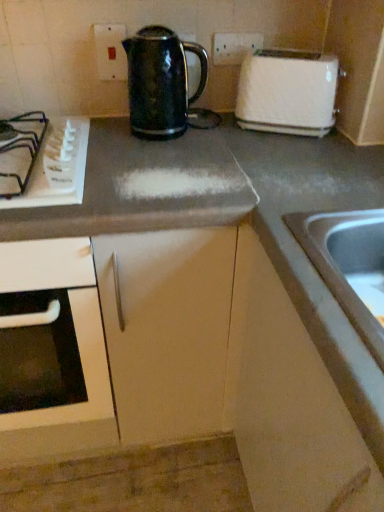
How much space does matte gray cabinet at lower right, positioned as the 1th cabinetry in right-to-left order, occupy horizontally?

matte gray cabinet at lower right, positioned as the 1th cabinetry in right-to-left order, is 61.93 centimeters in width.

What do you see at coordinates (299, 391) in the screenshot? I see `matte gray cabinet at lower right, positioned as the 1th cabinetry in right-to-left order` at bounding box center [299, 391].

What is the approximate height of white plastic gas stove at left?

It is 5.41 centimeters.

This screenshot has width=384, height=512. Find the location of `white plastic toaster at upper right`. white plastic toaster at upper right is located at coordinates (288, 92).

Measure the distance between white plastic toaster at upper right and camera.

3.39 feet.

This screenshot has width=384, height=512. Describe the element at coordinates (160, 81) in the screenshot. I see `shiny black kettle at center` at that location.

Image resolution: width=384 pixels, height=512 pixels. What do you see at coordinates (166, 328) in the screenshot?
I see `matte gray cabinet at center, placed as the 1th cabinetry when sorted from left to right` at bounding box center [166, 328].

At what (x,y) coordinates should I click in order to perform the action: click on matte gray cabinet at lower right, which is the 2th cabinetry in left-to-right order. Please return your answer as a coordinate pair (x, y). Looking at the image, I should click on (299, 391).

How distant is white plastic toaster at upper right from shiny black kettle at center?

They are 9.91 inches apart.

Which of these two, white plastic toaster at upper right or shiny black kettle at center, is wider?

shiny black kettle at center is wider.

Consider the image. How different are the orientations of white plastic toaster at upper right and shiny black kettle at center in degrees?

The angular difference between white plastic toaster at upper right and shiny black kettle at center is 27.7 degrees.

Considering the sizes of objects white plastic toaster at upper right and shiny black kettle at center in the image provided, who is taller, white plastic toaster at upper right or shiny black kettle at center?

shiny black kettle at center.

Considering the points (41, 190) and (242, 259), which point is behind, point (41, 190) or point (242, 259)?

The point (242, 259) is farther.

Can you confirm if white plastic gas stove at left is wider than matte gray cabinet at lower right, positioned as the 1th cabinetry in right-to-left order?

In fact, white plastic gas stove at left might be narrower than matte gray cabinet at lower right, positioned as the 1th cabinetry in right-to-left order.

From the image's perspective, is white plastic gas stove at left above or below matte gray cabinet at lower right, which is the 2th cabinetry in left-to-right order?

Based on their image positions, white plastic gas stove at left is located above matte gray cabinet at lower right, which is the 2th cabinetry in left-to-right order.

Locate an element on the screen. cabinetry that is the 2nd one when counting rightward from the white plastic gas stove at left is located at coordinates (299, 391).

Is matte gray cabinet at lower right, positioned as the 1th cabinetry in right-to-left order, aimed at shiny black kettle at center?

No, matte gray cabinet at lower right, positioned as the 1th cabinetry in right-to-left order, is not turned towards shiny black kettle at center.

From the picture: Visually, is matte gray cabinet at lower right, which is the 2th cabinetry in left-to-right order, positioned to the left or to the right of shiny black kettle at center?

matte gray cabinet at lower right, which is the 2th cabinetry in left-to-right order, is positioned on shiny black kettle at center's right side.

From a real-world perspective, relative to shiny black kettle at center, is matte gray cabinet at lower right, which is the 2th cabinetry in left-to-right order, vertically above or below?

matte gray cabinet at lower right, which is the 2th cabinetry in left-to-right order, is situated lower than shiny black kettle at center in the real world.

From a real-world perspective, is white plastic toaster at upper right physically located above or below matte gray cabinet at center, arranged as the 2th cabinetry when viewed from the right?

From a real-world perspective, white plastic toaster at upper right is physically above matte gray cabinet at center, arranged as the 2th cabinetry when viewed from the right.

Which object is further away from the camera, white plastic toaster at upper right or matte gray cabinet at center, arranged as the 2th cabinetry when viewed from the right?

white plastic toaster at upper right is more distant.

Which is less distant, [264,72] or [133,402]?

Point [264,72] is positioned closer to the camera compared to point [133,402].

How much distance is there between white plastic toaster at upper right and matte gray cabinet at center, arranged as the 2th cabinetry when viewed from the right?

white plastic toaster at upper right and matte gray cabinet at center, arranged as the 2th cabinetry when viewed from the right, are 21.75 inches apart from each other.

Between matte gray cabinet at center, arranged as the 2th cabinetry when viewed from the right, and stainless steel sink at lower right, which one is positioned in front?

stainless steel sink at lower right.

From the image's perspective, is matte gray cabinet at center, arranged as the 2th cabinetry when viewed from the right, over stainless steel sink at lower right?

No, from the image's perspective, matte gray cabinet at center, arranged as the 2th cabinetry when viewed from the right, is not on top of stainless steel sink at lower right.

Could you tell me if matte gray cabinet at center, arranged as the 2th cabinetry when viewed from the right, is facing stainless steel sink at lower right?

No, matte gray cabinet at center, arranged as the 2th cabinetry when viewed from the right, is not facing towards stainless steel sink at lower right.

Could you measure the distance between matte gray cabinet at lower right, which is the 2th cabinetry in left-to-right order, and white plastic gas stove at left?

A distance of 20.19 inches exists between matte gray cabinet at lower right, which is the 2th cabinetry in left-to-right order, and white plastic gas stove at left.

Is matte gray cabinet at lower right, positioned as the 1th cabinetry in right-to-left order, surrounding white plastic gas stove at left?

No, white plastic gas stove at left is located outside of matte gray cabinet at lower right, positioned as the 1th cabinetry in right-to-left order.

From the image's perspective, relative to white plastic gas stove at left, is matte gray cabinet at lower right, which is the 2th cabinetry in left-to-right order, above or below?

matte gray cabinet at lower right, which is the 2th cabinetry in left-to-right order, is below white plastic gas stove at left.

The height and width of the screenshot is (512, 384). What are the coordinates of `gas stove above the matte gray cabinet at lower right, which is the 2th cabinetry in left-to-right order (from the image's perspective)` in the screenshot? It's located at (57, 167).

How different are the orientations of shiny black kettle at center and white plastic toaster at upper right in degrees?

27.7 degrees separate the facing orientations of shiny black kettle at center and white plastic toaster at upper right.

From the image's perspective, is shiny black kettle at center below white plastic toaster at upper right?

No.

From a real-world perspective, which object rests below the other?

white plastic toaster at upper right.

Find the location of a particular element. Image resolution: width=384 pixels, height=512 pixels. toaster behind the shiny black kettle at center is located at coordinates (288, 92).

The width and height of the screenshot is (384, 512). Identify the location of gas stove above the matte gray cabinet at lower right, which is the 2th cabinetry in left-to-right order (from a real-world perspective). (57, 167).

Looking at the image, which one is located further to matte gray cabinet at center, placed as the 1th cabinetry when sorted from left to right, stainless steel sink at lower right or matte white electric outlet at upper center?

Based on the image, matte white electric outlet at upper center appears to be further to matte gray cabinet at center, placed as the 1th cabinetry when sorted from left to right.

From the picture: Estimate the real-world distances between objects in this image. Which object is closer to matte gray cabinet at lower right, which is the 2th cabinetry in left-to-right order, stainless steel sink at lower right or matte white electric outlet at upper center?

stainless steel sink at lower right lies closer to matte gray cabinet at lower right, which is the 2th cabinetry in left-to-right order, than the other object.

Which object lies further to the anchor point shiny black kettle at center, white plastic gas stove at left or white plastic toaster at upper right?

The object further to shiny black kettle at center is white plastic gas stove at left.

Based on their spatial positions, is matte gray cabinet at lower right, positioned as the 1th cabinetry in right-to-left order, or stainless steel sink at lower right further from white plastic gas stove at left?

Based on the image, stainless steel sink at lower right appears to be further to white plastic gas stove at left.

Based on their spatial positions, is stainless steel sink at lower right or matte white electric outlet at upper center closer to white plastic gas stove at left?

The object closer to white plastic gas stove at left is matte white electric outlet at upper center.

Considering their positions, is stainless steel sink at lower right positioned further to matte gray cabinet at lower right, positioned as the 1th cabinetry in right-to-left order, than white plastic toaster at upper right?

white plastic toaster at upper right is further to matte gray cabinet at lower right, positioned as the 1th cabinetry in right-to-left order.

Based on their spatial positions, is matte gray cabinet at center, arranged as the 2th cabinetry when viewed from the right, or shiny black kettle at center further from white plastic toaster at upper right?

Based on the image, matte gray cabinet at center, arranged as the 2th cabinetry when viewed from the right, appears to be further to white plastic toaster at upper right.

Looking at the image, which one is located closer to stainless steel sink at lower right, matte white electric outlet at upper center or white plastic toaster at upper right?

white plastic toaster at upper right lies closer to stainless steel sink at lower right than the other object.

In order to click on kettle between matte white electric outlet at upper center and matte gray cabinet at lower right, which is the 2th cabinetry in left-to-right order, vertically in this screenshot , I will do `click(160, 81)`.

I want to click on kettle between white plastic gas stove at left and white plastic toaster at upper right from left to right, so click(x=160, y=81).

What are the coordinates of `sink that lies between shiny black kettle at center and matte gray cabinet at lower right, which is the 2th cabinetry in left-to-right order, from top to bottom` in the screenshot? It's located at (349, 265).

At what (x,y) coordinates should I click in order to perform the action: click on kettle between matte white electric outlet at upper center and stainless steel sink at lower right vertically. Please return your answer as a coordinate pair (x, y). Looking at the image, I should click on (160, 81).